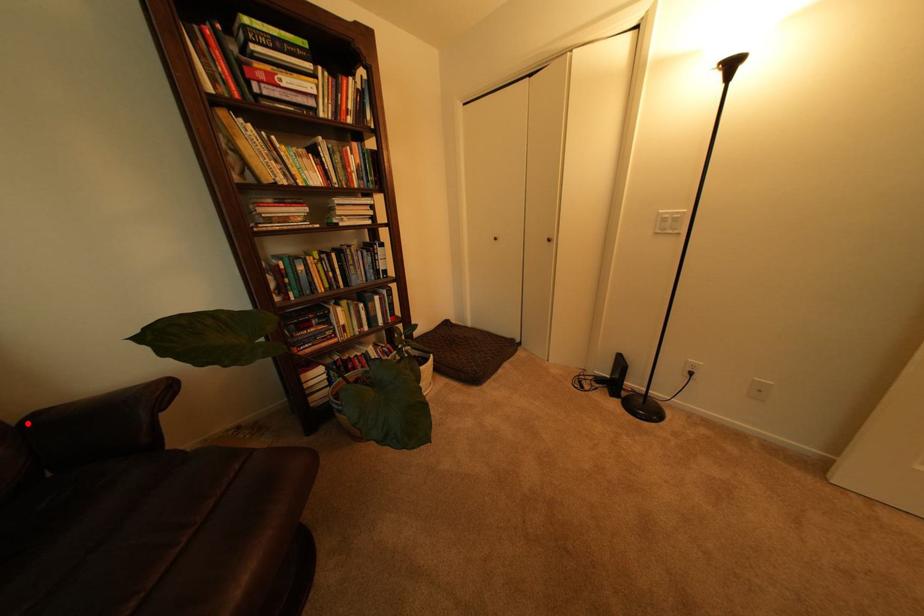
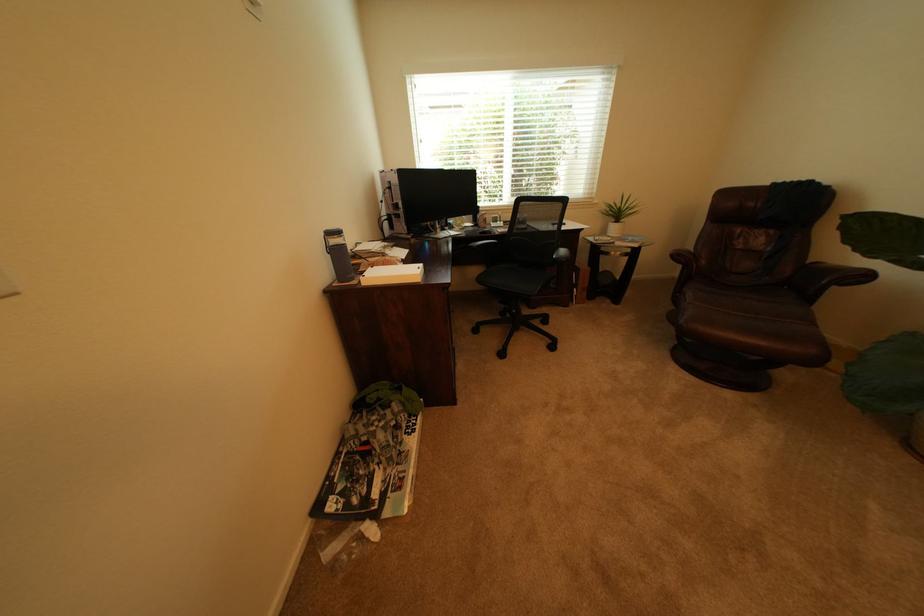
Question: I am providing you with two images of the same scene from different viewpoints. Image1 has a red point marked. In image2, the corresponding 3D location appears at what relative position? Reply with the corresponding letter.

Choices:
 (A) Closer
 (B) Farther

Answer: (B)